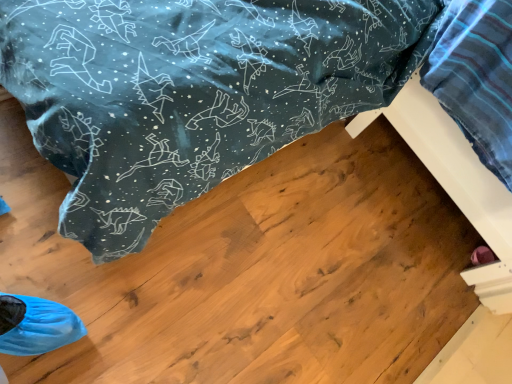
Question: Based on their sizes in the image, would you say wooden bed frame at lower right, which is the second furniture from right to left, is bigger or smaller than white wood bed frame at lower right, the second furniture viewed from the left?

Choices:
 (A) big
 (B) small

Answer: (B)

Question: Is wooden bed frame at lower right, which is the second furniture from right to left, in front of or behind white wood bed frame at lower right, the second furniture viewed from the left, in the image?

Choices:
 (A) behind
 (B) front

Answer: (A)

Question: Would you say wooden bed frame at lower right, which is the second furniture from right to left, is inside or outside white wood bed frame at lower right, the second furniture viewed from the left?

Choices:
 (A) inside
 (B) outside

Answer: (B)

Question: Is white wood bed frame at lower right, the 1th furniture in the right-to-left sequence, taller or shorter than wooden bed frame at lower right, placed as the first furniture when sorted from left to right?

Choices:
 (A) tall
 (B) short

Answer: (A)

Question: In the image, is white wood bed frame at lower right, the second furniture viewed from the left, positioned in front of or behind wooden bed frame at lower right, placed as the first furniture when sorted from left to right?

Choices:
 (A) front
 (B) behind

Answer: (A)

Question: From a real-world perspective, is white wood bed frame at lower right, the second furniture viewed from the left, above or below wooden bed frame at lower right, which is the second furniture from right to left?

Choices:
 (A) above
 (B) below

Answer: (A)

Question: In terms of size, does white wood bed frame at lower right, the second furniture viewed from the left, appear bigger or smaller than wooden bed frame at lower right, placed as the first furniture when sorted from left to right?

Choices:
 (A) big
 (B) small

Answer: (A)